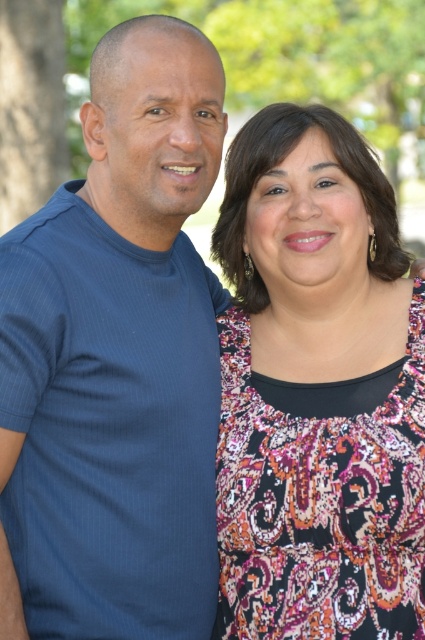
Can you confirm if printed fabric blouse at center is positioned to the left of blue ribbed t-shirt at left?

In fact, printed fabric blouse at center is to the right of blue ribbed t-shirt at left.

Which is more to the left, printed fabric blouse at center or blue ribbed t-shirt at left?

Positioned to the left is blue ribbed t-shirt at left.

This screenshot has height=640, width=425. I want to click on printed fabric blouse at center, so click(x=317, y=390).

Does blue ribbed t-shirt at left appear under green leafy tree at left?

Yes.

This screenshot has height=640, width=425. What do you see at coordinates (139, 339) in the screenshot? I see `blue ribbed t-shirt at left` at bounding box center [139, 339].

The width and height of the screenshot is (425, 640). What are the coordinates of `blue ribbed t-shirt at left` in the screenshot? It's located at (139, 339).

Locate an element on the screen. blue ribbed t-shirt at left is located at coordinates (139, 339).

Can you confirm if printed fabric blouse at center is thinner than green leafy tree at left?

Correct, printed fabric blouse at center's width is less than green leafy tree at left's.

Between point (244, 300) and point (33, 8), which one is positioned in front?

Point (244, 300) is in front.

Find the location of a particular element. The width and height of the screenshot is (425, 640). printed fabric blouse at center is located at coordinates (317, 390).